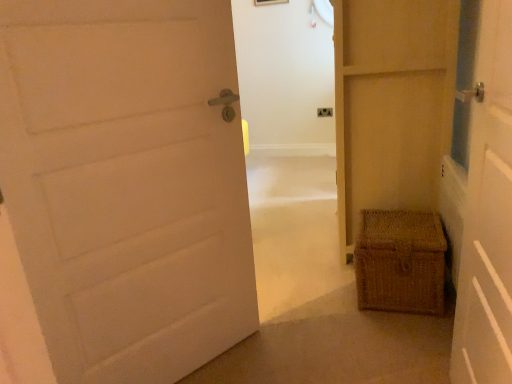
Question: From a real-world perspective, relative to white matte door at left, the 3th door when ordered from right to left, is matte plastic electrical outlet at center vertically above or below?

Choices:
 (A) above
 (B) below

Answer: (B)

Question: Which is correct: matte plastic electrical outlet at center is inside white matte door at left, the 3th door when ordered from right to left, or outside of it?

Choices:
 (A) inside
 (B) outside

Answer: (B)

Question: Estimate the real-world distances between objects in this image. Which object is farther from the matte beige door at center, which is the 1th door from right to left?

Choices:
 (A) white matte door at right, which ranks as the second door in right-to-left order
 (B) wooden picture frame at upper center
 (C) white matte door at left, the first door viewed from the left
 (D) matte plastic electrical outlet at center
 (E) woven brown basket at right

Answer: (B)

Question: Which object is the farthest from the matte beige door at center, which is the 1th door from right to left?

Choices:
 (A) wooden picture frame at upper center
 (B) white matte door at right, the second door in the left-to-right sequence
 (C) woven brown basket at right
 (D) matte plastic electrical outlet at center
 (E) white matte door at left, the 3th door when ordered from right to left

Answer: (A)